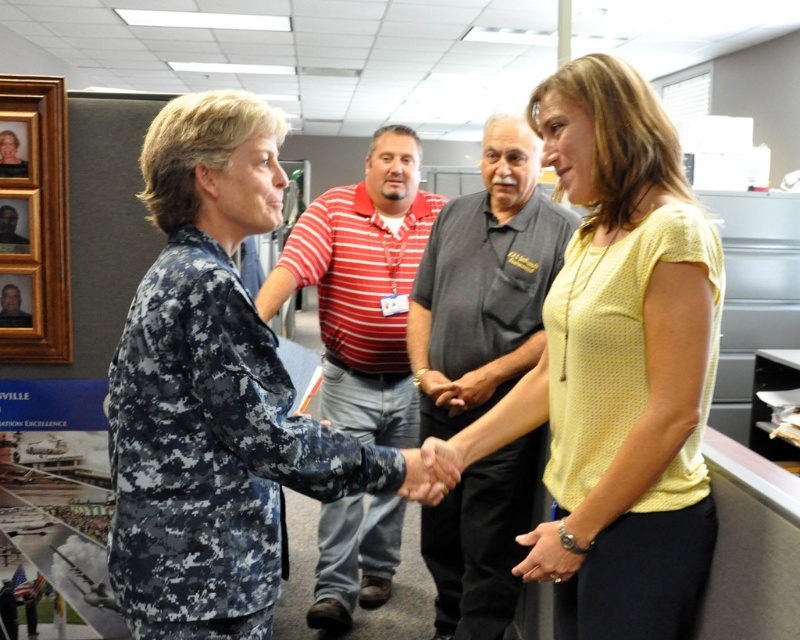
You are an office assistant who needs to determine the relative sizes of two items in the scene to ensure they fit into storage boxes. The boxes are labeled for items of different sizes. Which object is bigger between the yellow dotted blouse at center and the brushed metal picture frame at upper left?

The yellow dotted blouse at center is larger in size compared to the brushed metal picture frame at upper left, so it should be placed in the larger storage box.

You are standing at the origin point of the image. Which of the two points, point (646, 424) or point (28, 124), is closer to you?

Point (28, 124) is closer to you because it is behind point (646, 424), which is in front of it.